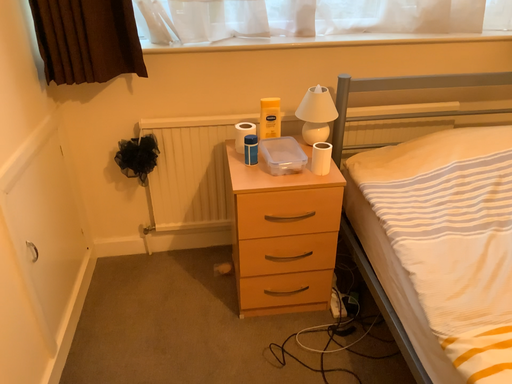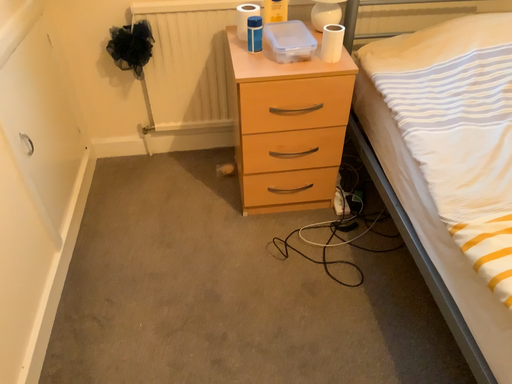
Question: How did the camera likely rotate when shooting the video?

Choices:
 (A) rotated upward
 (B) rotated downward

Answer: (B)